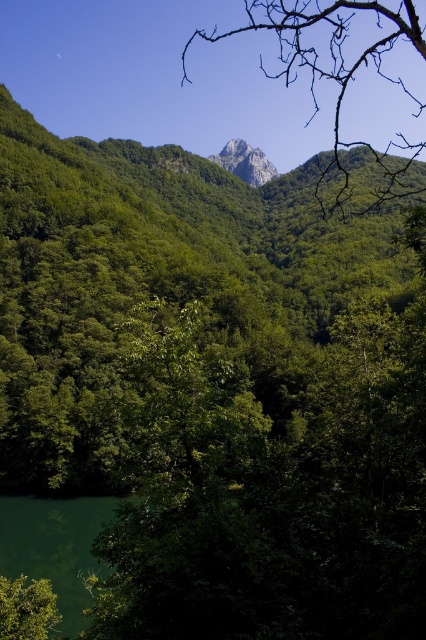
Question: Based on their relative distances, which object is nearer to the green liquid at lower left?

Choices:
 (A) rugged granite peak at center
 (B) bare branches at upper center

Answer: (B)

Question: Which point is farther from the camera taking this photo?

Choices:
 (A) (282, 45)
 (B) (74, 625)

Answer: (A)

Question: Is green liquid at lower left behind rugged granite peak at center?

Choices:
 (A) no
 (B) yes

Answer: (A)

Question: Where is green liquid at lower left located in relation to rugged granite peak at center in the image?

Choices:
 (A) below
 (B) above

Answer: (A)

Question: Can you confirm if bare branches at upper center is positioned below green liquid at lower left?

Choices:
 (A) no
 (B) yes

Answer: (A)

Question: Based on their relative distances, which object is nearer to the rugged granite peak at center?

Choices:
 (A) bare branches at upper center
 (B) green liquid at lower left

Answer: (A)